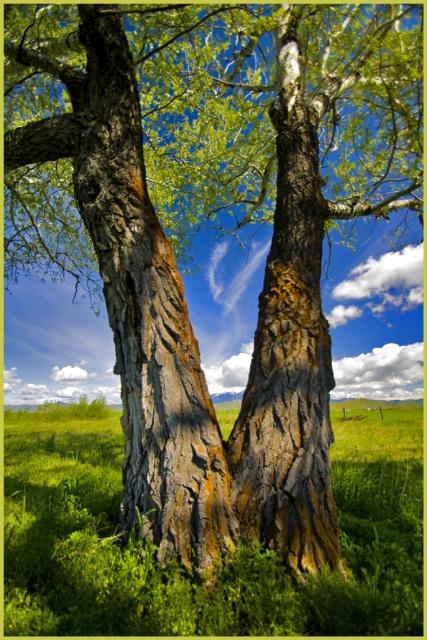
Question: Is green grass at center to the left of rough bark tree trunk at center from the viewer's perspective?

Choices:
 (A) yes
 (B) no

Answer: (A)

Question: Can you confirm if green grass at center is bigger than rough bark tree trunk at center?

Choices:
 (A) no
 (B) yes

Answer: (B)

Question: Among these points, which one is nearest to the camera?

Choices:
 (A) (321, 618)
 (B) (99, 184)

Answer: (A)

Question: Is the position of green grass at center less distant than that of rough bark tree trunk at center?

Choices:
 (A) yes
 (B) no

Answer: (A)